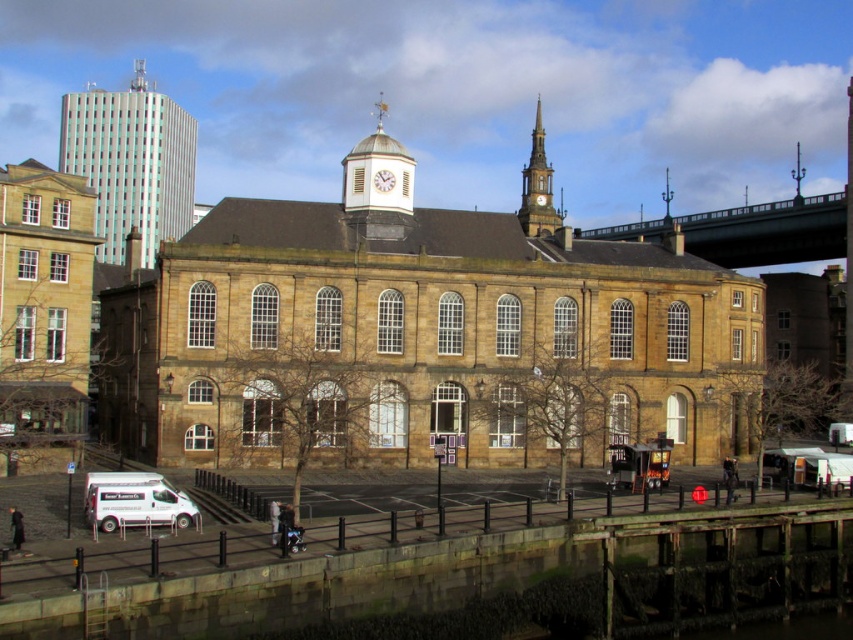
Question: Which of the following is the closest to the observer?

Choices:
 (A) brown stone church at left
 (B) metallic glass tower at upper left

Answer: (A)

Question: Is brown stone church at left further to camera compared to white wooden clock at center?

Choices:
 (A) yes
 (B) no

Answer: (B)

Question: Does brown stone church at center appear over white matte van at lower left?

Choices:
 (A) yes
 (B) no

Answer: (A)

Question: Which is nearer to the stone clock tower at upper center?

Choices:
 (A) green metallic bridge at upper right
 (B) metallic glass tower at upper left
 (C) white matte van at lower left
 (D) brown stone church at center

Answer: (D)

Question: Which of the following is the farthest from the observer?

Choices:
 (A) metallic glass tower at upper left
 (B) green metallic bridge at upper right

Answer: (B)

Question: Observing the image, what is the correct spatial positioning of metallic glass tower at upper left in reference to stone clock tower at upper center?

Choices:
 (A) above
 (B) below

Answer: (B)